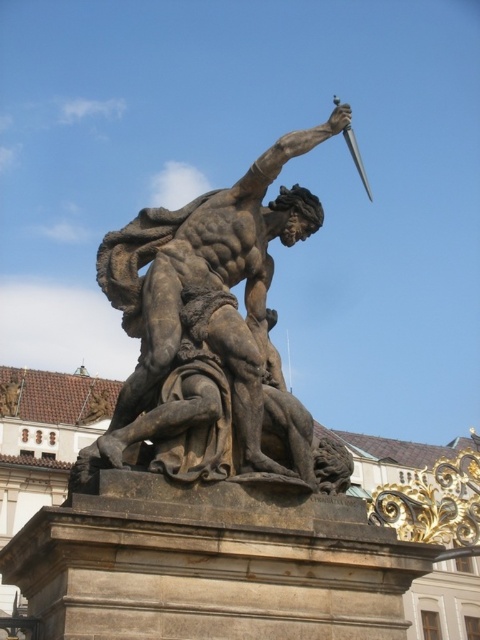
You are an art curator planning to install a spotlight on the bronze statue at center. The spotlight can only illuminate objects above it. Will the shiny silver sword at upper right be illuminated by the spotlight?

The bronze statue at center is located below the shiny silver sword at upper right, so the spotlight placed on the bronze statue at center will illuminate the shiny silver sword at upper right since it is positioned above it.

You are an art curator planning to display the bronze statue at center and the shiny silver sword at upper right in a gallery. Given their sizes, which object should be placed on a pedestal to ensure proper visibility?

The bronze statue at center is smaller than the shiny silver sword at upper right, so placing the bronze statue at center on a pedestal would elevate it to ensure proper visibility compared to the taller shiny silver sword at upper right.